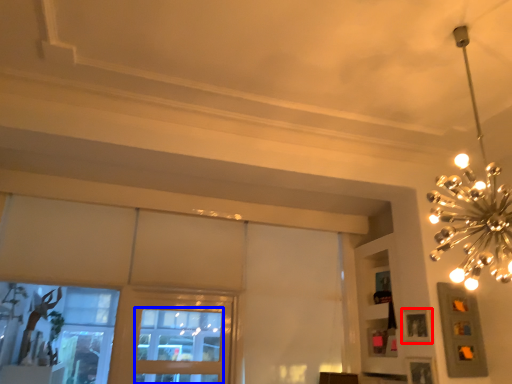
Question: Which object appears closest to the camera in this image, picture frame (highlighted by a red box) or window (highlighted by a blue box)?

Choices:
 (A) picture frame
 (B) window

Answer: (A)